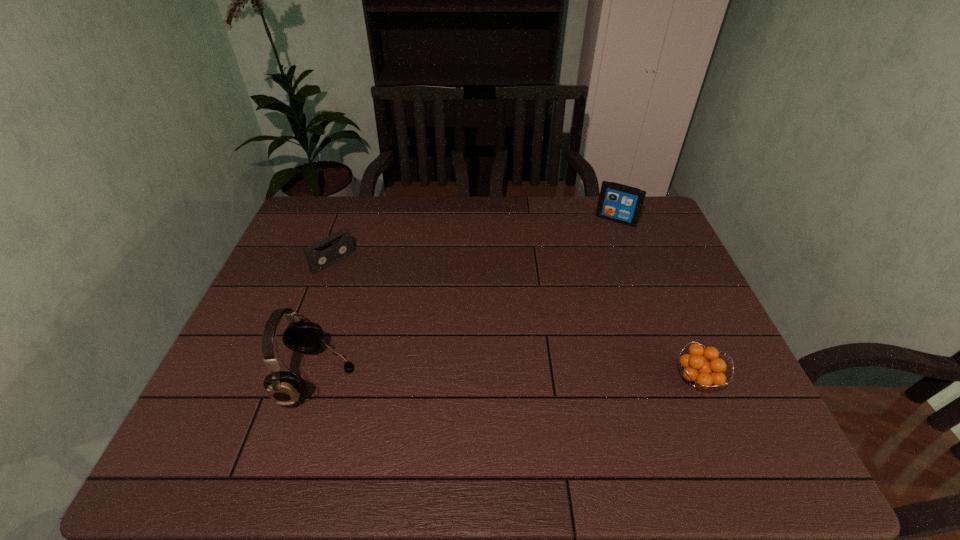
Where is `vacant space located 0.090m on the front-facing side of the second farthest object`? The width and height of the screenshot is (960, 540). vacant space located 0.090m on the front-facing side of the second farthest object is located at coordinates (361, 286).

The image size is (960, 540). I want to click on free space located 0.070m on the front-facing side of the second farthest object, so click(x=357, y=282).

Identify the location of object at the far edge. (617, 202).

Find the location of a particular element. Image resolution: width=960 pixels, height=540 pixels. headset that is at the near edge is located at coordinates (285, 388).

The width and height of the screenshot is (960, 540). Identify the location of orange fruit located at the near edge. (701, 374).

The height and width of the screenshot is (540, 960). Find the location of `headset at the left edge`. headset at the left edge is located at coordinates point(285,388).

Identify the location of videotape that is at the left edge. (320, 255).

Locate an element on the screen. The image size is (960, 540). orange fruit situated at the right edge is located at coordinates (701, 374).

I want to click on iPod that is at the right edge, so click(617, 202).

Image resolution: width=960 pixels, height=540 pixels. What are the coordinates of `object that is at the near left corner` in the screenshot? It's located at (285, 388).